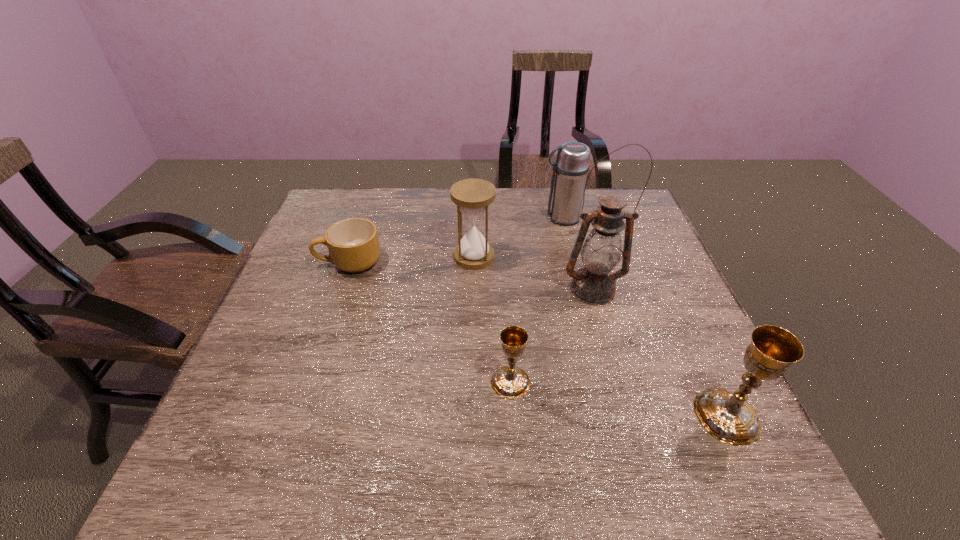
At what (x,y) coordinates should I click in order to perform the action: click on free space that satisfies the following two spatial constraints: 1. on the side with the handle of the hourglass; 2. on the right side of the leftmost object. Please return your answer as a coordinate pair (x, y). The height and width of the screenshot is (540, 960). Looking at the image, I should click on (351, 257).

Find the location of a particular element. This screenshot has width=960, height=540. free location that satisfies the following two spatial constraints: 1. on the back side of the taller chalice; 2. with a handle on the side of the thermos bottle is located at coordinates (636, 218).

In order to click on vacant position in the image that satisfies the following two spatial constraints: 1. with a handle on the side of the thermos bottle; 2. on the left side of the tallest object in this screenshot , I will do `click(578, 289)`.